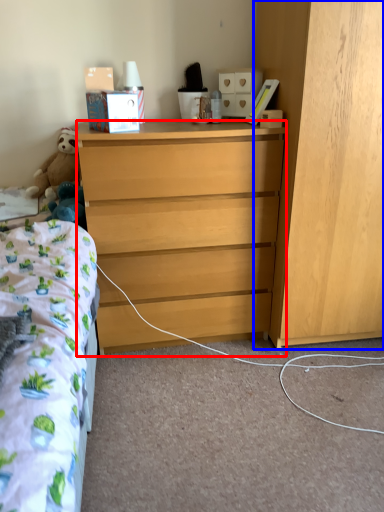
Question: Which object appears closest to the camera in this image, desk (highlighted by a red box) or cabinetry (highlighted by a blue box)?

Choices:
 (A) desk
 (B) cabinetry

Answer: (B)